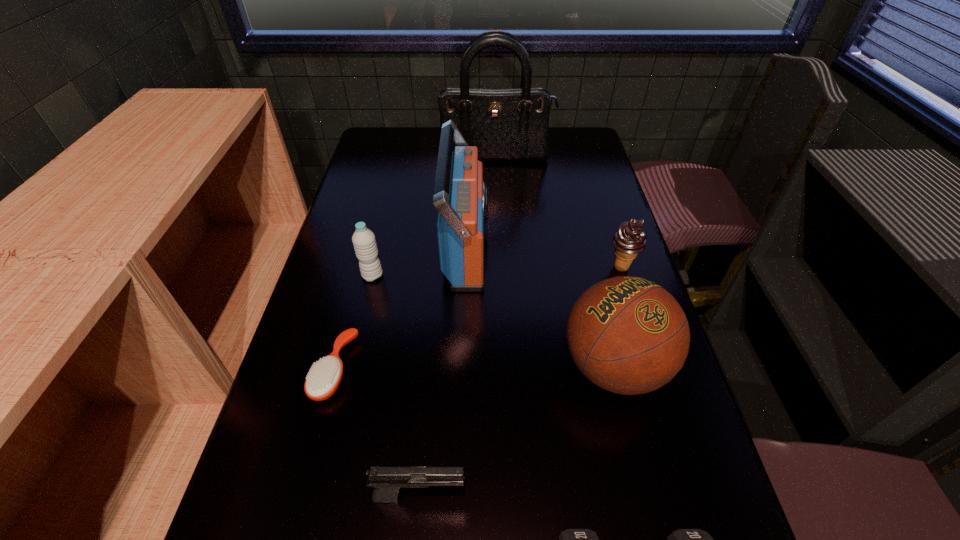
The width and height of the screenshot is (960, 540). Identify the location of free location that satisfies the following two spatial constraints: 1. on the front side of the icecream; 2. aim along the barrel of the second nearest object. (694, 495).

Identify the location of vacant point that satisfies the following two spatial constraints: 1. with an open clasp on the front of the icecream; 2. on the left side of the farthest object. (501, 267).

I want to click on vacant space that satisfies the following two spatial constraints: 1. with an open clasp on the front of the icecream; 2. on the right side of the farthest object, so click(501, 267).